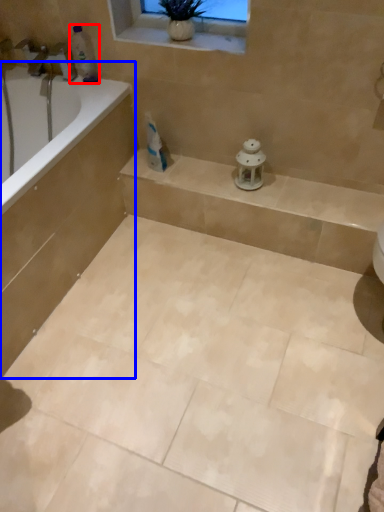
Question: Which object is closer to the camera taking this photo, toiletry (highlighted by a red box) or bath (highlighted by a blue box)?

Choices:
 (A) toiletry
 (B) bath

Answer: (B)